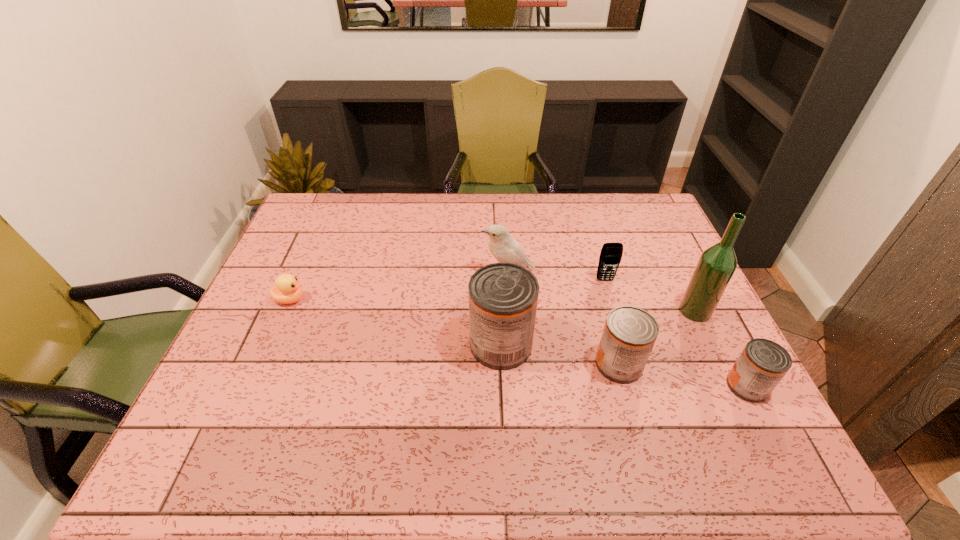
Where is `vacant position in the image that satisfies the following two spatial constraints: 1. on the screen of the cellular telephone; 2. on the face of the duckling`? vacant position in the image that satisfies the following two spatial constraints: 1. on the screen of the cellular telephone; 2. on the face of the duckling is located at coordinates (611, 300).

Locate an element on the screen. The width and height of the screenshot is (960, 540). blank area in the image that satisfies the following two spatial constraints: 1. on the screen of the cellular telephone; 2. on the face of the shortest object is located at coordinates (611, 300).

This screenshot has width=960, height=540. I want to click on free space that satisfies the following two spatial constraints: 1. on the screen of the rightmost can; 2. on the left side of the cellular telephone, so click(636, 386).

Identify the location of free point that satisfies the following two spatial constraints: 1. at the beak of the third tallest object; 2. on the front side of the tallest can. (513, 345).

Find the location of `vacant space that satisfies the following two spatial constraints: 1. at the beak of the tallest object; 2. on the left side of the fifth shortest object`. vacant space that satisfies the following two spatial constraints: 1. at the beak of the tallest object; 2. on the left side of the fifth shortest object is located at coordinates (510, 311).

You are a GUI agent. You are given a task and a screenshot of the screen. Output one action in this format:
    pyautogui.click(x=<x>, y=<y>)
    Task: Click on the vacant area in the image that satisfies the following two spatial constraints: 1. at the beak of the third tallest object; 2. on the back side of the second can from left to right
    
    Given the screenshot: What is the action you would take?
    pyautogui.click(x=514, y=364)